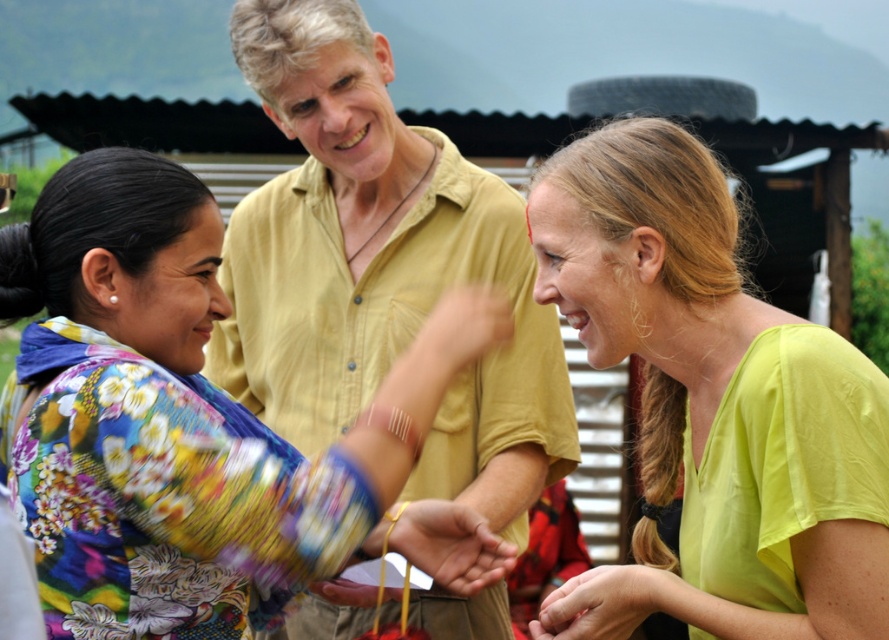
Which is above, yellow string at center or smooth skin hand at lower center?

Positioned higher is yellow string at center.

How far apart are yellow string at center and smooth skin hand at lower center?

They are 8.07 inches apart.

The width and height of the screenshot is (889, 640). Identify the location of yellow string at center. (444, 545).

Can you confirm if lime green fabric at center is positioned below smooth yellow hand at center?

Yes.

Is lime green fabric at center bigger than smooth yellow hand at center?

Yes.

Is point (813, 636) positioned in front of point (433, 348)?

Yes, it is.

Where is `lime green fabric at center`? lime green fabric at center is located at coordinates (703, 401).

Between lime green fabric at center and smooth skin hand at lower center, which one has less height?

Standing shorter between the two is smooth skin hand at lower center.

Can you confirm if lime green fabric at center is positioned below smooth skin hand at lower center?

No.

Who is more forward, (627,212) or (661,577)?

Positioned in front is point (627,212).

Identify the location of lime green fabric at center. The image size is (889, 640). (703, 401).